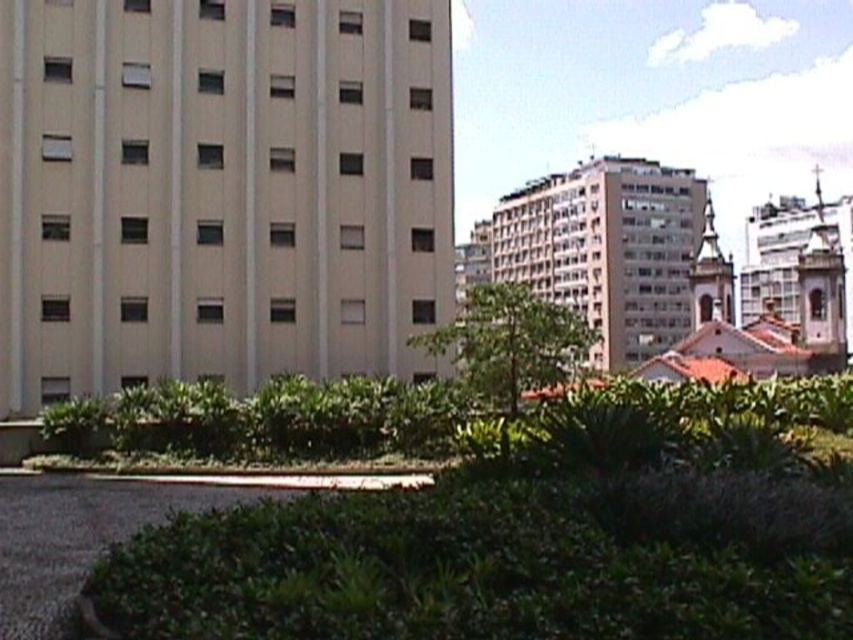
Question: Estimate the real-world distances between objects in this image. Which object is closer to the white stone church at upper right?

Choices:
 (A) beige smooth building at left
 (B) gold textured church steeple at upper right

Answer: (B)

Question: Which of the following is the closest to the observer?

Choices:
 (A) gold textured church steeple at upper right
 (B) white stone church at upper right
 (C) beige textured building at center

Answer: (C)

Question: Can you confirm if white stone church at upper right is thinner than gold textured church steeple at upper right?

Choices:
 (A) no
 (B) yes

Answer: (A)

Question: Does beige smooth building at left come in front of beige textured building at center?

Choices:
 (A) no
 (B) yes

Answer: (A)

Question: Estimate the real-world distances between objects in this image. Which object is farther from the beige smooth building at left?

Choices:
 (A) gold textured church steeple at upper right
 (B) white stone church at upper right

Answer: (B)

Question: Is beige smooth building at left behind gold textured church steeple at upper right?

Choices:
 (A) no
 (B) yes

Answer: (A)